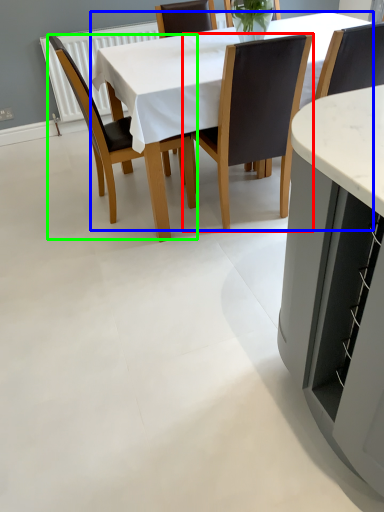
Question: Which is nearer to the chair (highlighted by a red box)? kitchen & dining room table (highlighted by a blue box) or chair (highlighted by a green box).

Choices:
 (A) kitchen & dining room table
 (B) chair

Answer: (A)